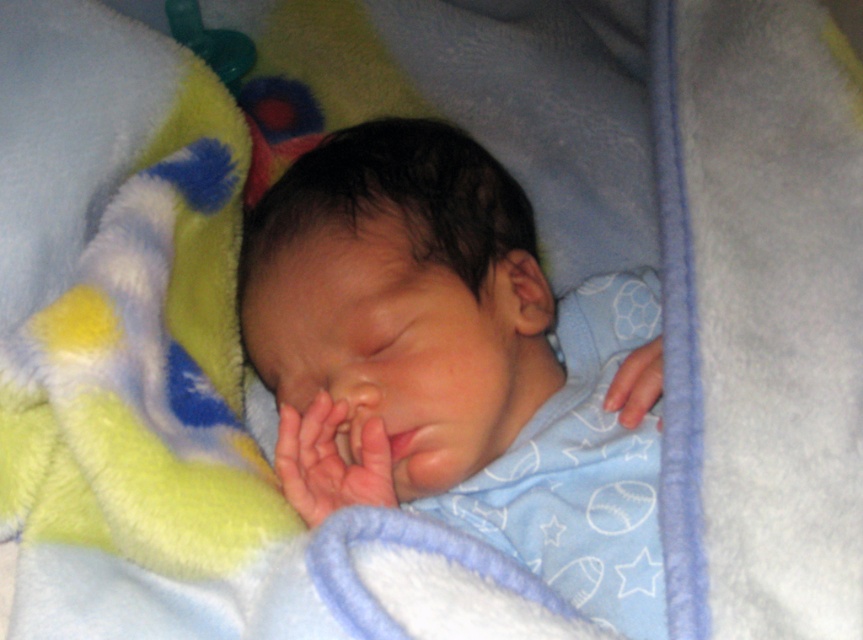
How distant is smooth blue blanket at center from smooth skin hand at center?

smooth blue blanket at center and smooth skin hand at center are 14.02 centimeters apart.

At what (x,y) coordinates should I click in order to perform the action: click on smooth blue blanket at center. Please return your answer as a coordinate pair (x, y). Looking at the image, I should click on (452, 362).

Find the location of a particular element. smooth blue blanket at center is located at coordinates (452, 362).

Is smooth blue blanket at center smaller than smooth skin hand at lower right?

Actually, smooth blue blanket at center might be larger than smooth skin hand at lower right.

Does point (378, 406) come in front of point (627, 410)?

Yes, it is in front of point (627, 410).

At what (x,y) coordinates should I click in order to perform the action: click on smooth blue blanket at center. Please return your answer as a coordinate pair (x, y). The height and width of the screenshot is (640, 863). Looking at the image, I should click on (452, 362).

Can you confirm if smooth skin hand at center is positioned to the left of smooth skin hand at lower right?

Correct, you'll find smooth skin hand at center to the left of smooth skin hand at lower right.

Is smooth skin hand at center thinner than smooth skin hand at lower right?

No, smooth skin hand at center is not thinner than smooth skin hand at lower right.

Which is behind, point (282, 460) or point (630, 403)?

Positioned behind is point (630, 403).

At what (x,y) coordinates should I click in order to perform the action: click on smooth skin hand at center. Please return your answer as a coordinate pair (x, y). Looking at the image, I should click on (331, 460).